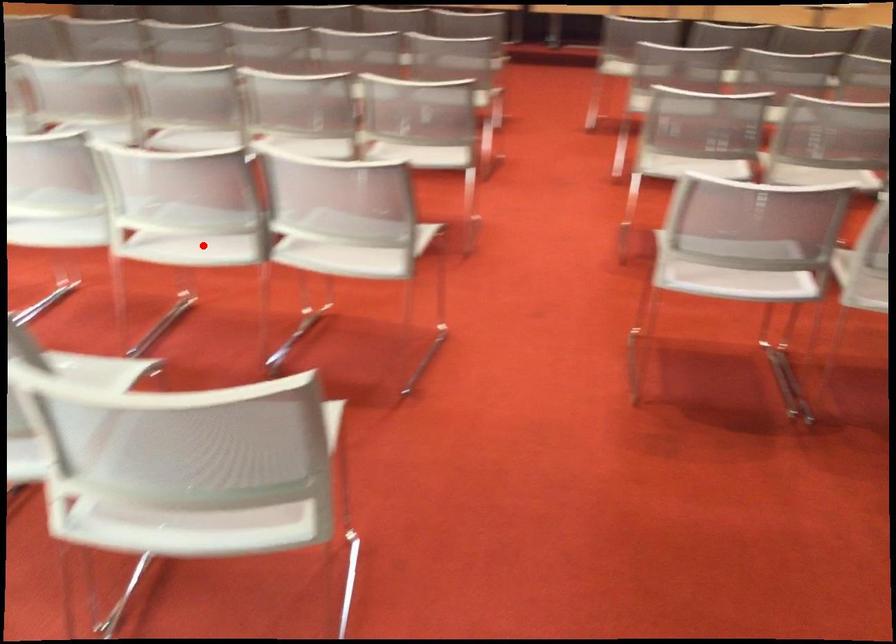
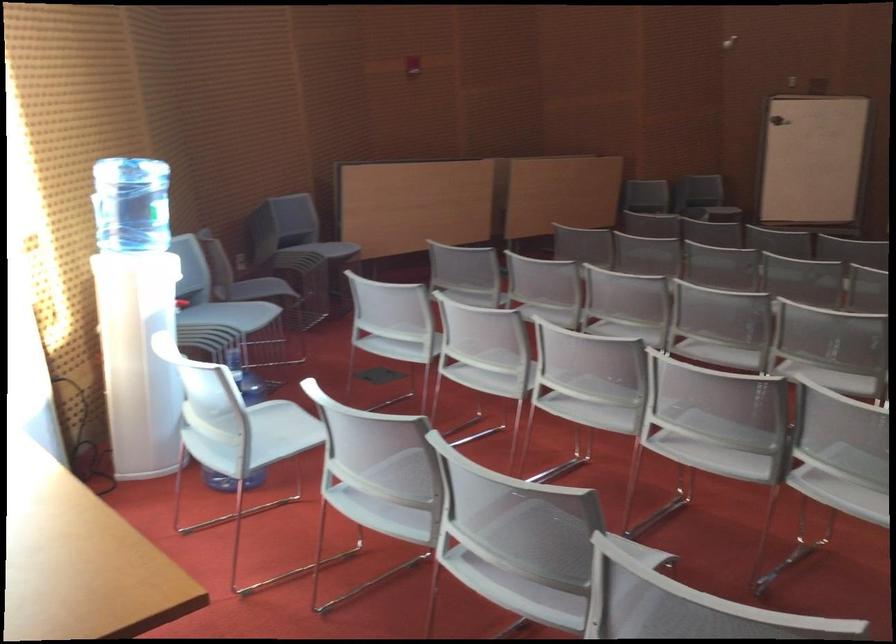
Find the pixel in the second image that matches the highlighted location in the first image.

(716, 453)